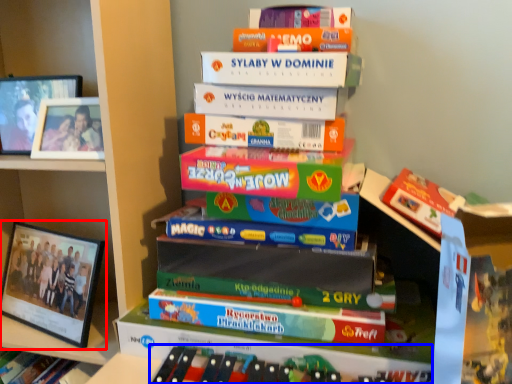
Question: Which of the following is the closest to the observer, picture frame (highlighted by a red box) or book (highlighted by a blue box)?

Choices:
 (A) picture frame
 (B) book

Answer: (B)